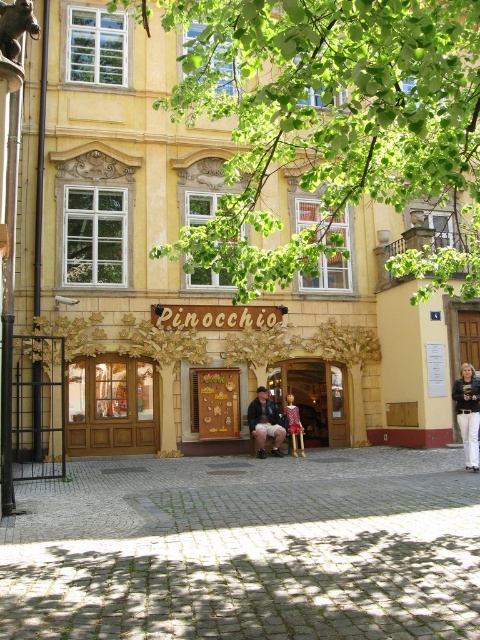
Question: Does green leafy tree at upper center lie in front of leather jacket at center?

Choices:
 (A) yes
 (B) no

Answer: (A)

Question: Can you confirm if white pants at lower right is positioned above matte pink dress at center?

Choices:
 (A) no
 (B) yes

Answer: (B)

Question: Estimate the real-world distances between objects in this image. Which object is farther from the green leafy tree at upper center?

Choices:
 (A) white pants at lower right
 (B) matte pink dress at center

Answer: (B)

Question: Which point is farther to the camera?

Choices:
 (A) (261, 410)
 (B) (19, 4)
 (C) (299, 419)
 (D) (404, 179)

Answer: (C)

Question: Where is green leafy tree at upper center located in relation to white pants at lower right in the image?

Choices:
 (A) right
 (B) left

Answer: (B)

Question: Which point is farther to the camera?

Choices:
 (A) (8, 4)
 (B) (266, 60)

Answer: (B)